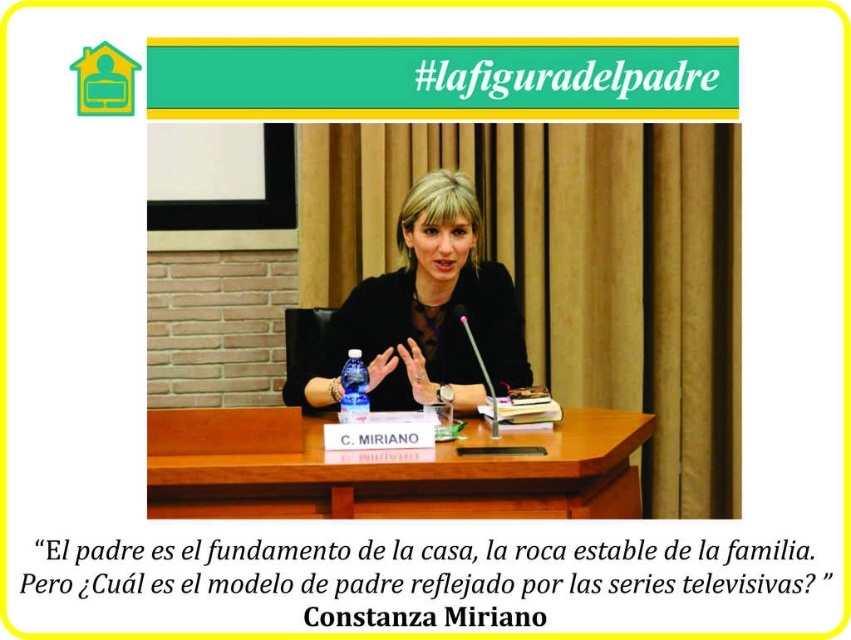
Question: Can you confirm if wooden table at center is positioned below matte black jacket at center?

Choices:
 (A) yes
 (B) no

Answer: (A)

Question: Can you confirm if wooden table at center is positioned to the right of matte black jacket at center?

Choices:
 (A) no
 (B) yes

Answer: (A)

Question: Which point is closer to the camera?

Choices:
 (A) wooden table at center
 (B) matte black jacket at center

Answer: (A)

Question: Does wooden table at center appear under matte black jacket at center?

Choices:
 (A) yes
 (B) no

Answer: (A)